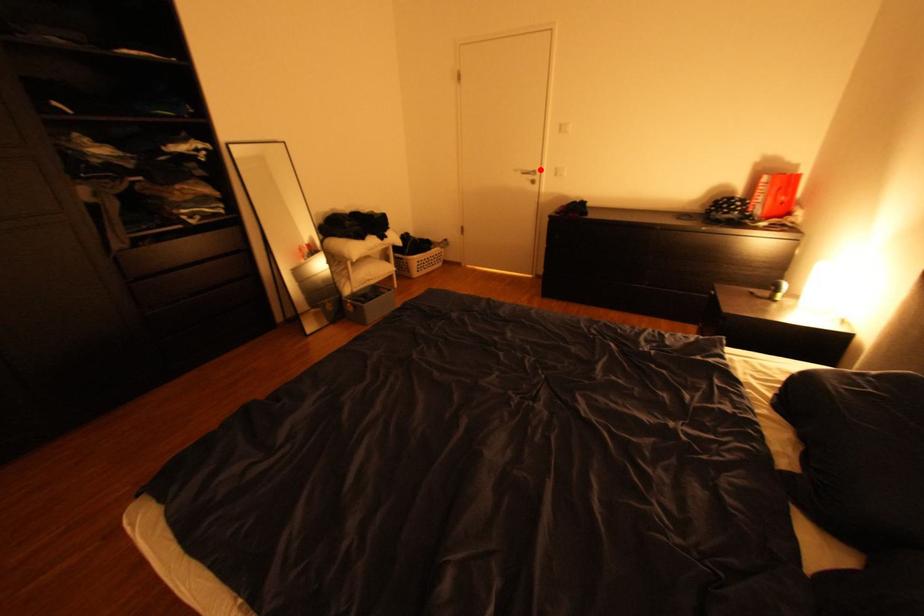
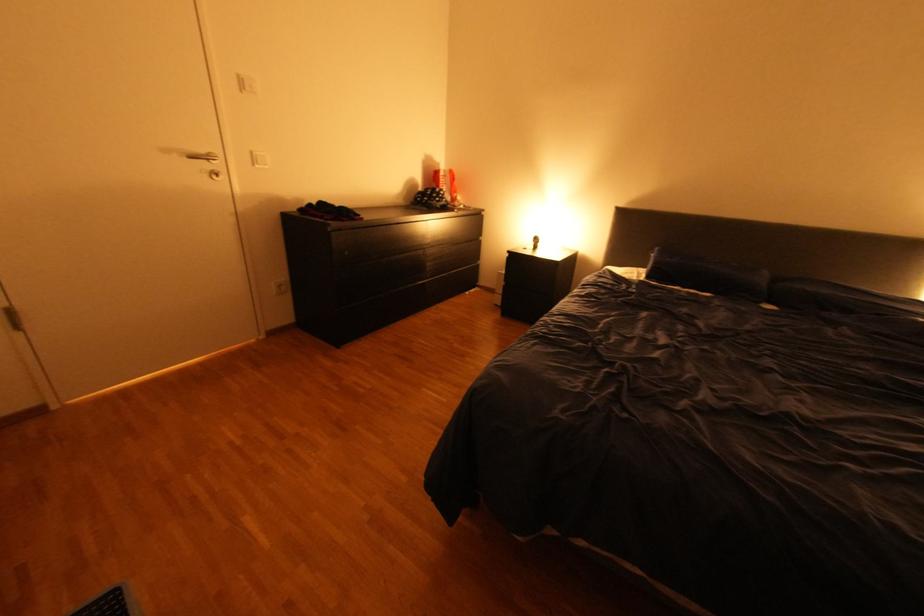
Locate, in the second image, the point that corresponds to the highlighted location in the first image.

(213, 151)